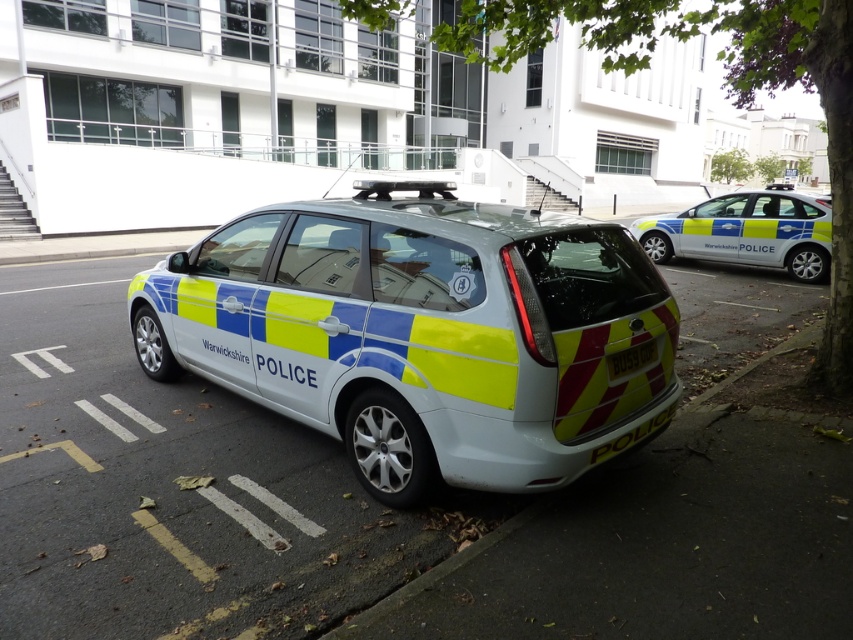
Question: Based on their relative distances, which object is nearer to the metallic silver police car at center?

Choices:
 (A) white plastic license plate at rear center
 (B) polished blue and yellow police car at right

Answer: (A)

Question: Which point is closer to the camera taking this photo?

Choices:
 (A) (653, 358)
 (B) (444, 225)

Answer: (B)

Question: Which point is closer to the camera?

Choices:
 (A) white plastic license plate at rear center
 (B) polished blue and yellow police car at right

Answer: (A)

Question: Does polished blue and yellow police car at right appear on the left side of white plastic license plate at rear center?

Choices:
 (A) no
 (B) yes

Answer: (A)

Question: Does polished blue and yellow police car at right appear on the left side of white plastic license plate at rear center?

Choices:
 (A) no
 (B) yes

Answer: (A)

Question: Is polished blue and yellow police car at right in front of white plastic license plate at rear center?

Choices:
 (A) yes
 (B) no

Answer: (B)